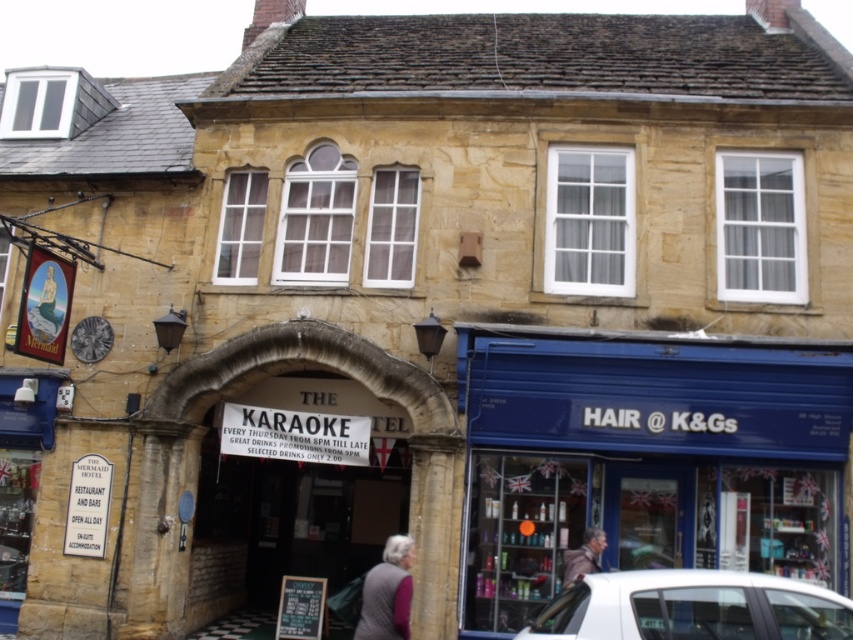
Question: Among these points, which one is nearest to the camera?

Choices:
 (A) (581, 556)
 (B) (817, 420)
 (C) (378, 627)

Answer: (C)

Question: Is blue painted wood hair @ k&gs at lower right above gray woolen sweater at lower center?

Choices:
 (A) no
 (B) yes

Answer: (A)

Question: From the image, what is the correct spatial relationship of blue painted wood hair @ k&gs at lower right in relation to gray woolen sweater at lower center?

Choices:
 (A) above
 (B) below

Answer: (B)

Question: Is white glossy car at lower right thinner than light brown leather jacket at lower center?

Choices:
 (A) no
 (B) yes

Answer: (A)

Question: Which object is closer to the camera taking this photo?

Choices:
 (A) gray woolen sweater at lower center
 (B) light brown leather jacket at lower center
 (C) blue painted wood hair @ k&gs at lower right
 (D) white glossy car at lower right

Answer: (D)

Question: Estimate the real-world distances between objects in this image. Which object is farther from the blue painted wood hair @ k&gs at lower right?

Choices:
 (A) light brown leather jacket at lower center
 (B) gray woolen sweater at lower center
 (C) white glossy car at lower right

Answer: (C)